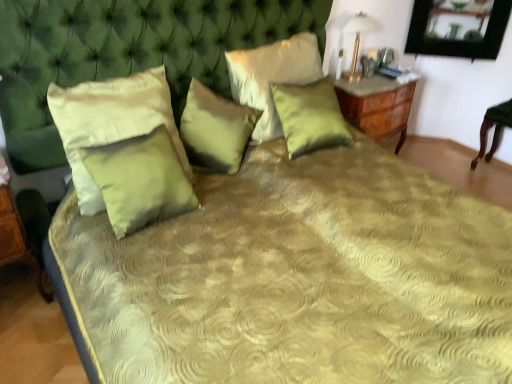
Question: From a real-world perspective, is satin green pillow at upper center, placed as the 4th pillow when sorted from left to right, beneath gold metallic table lamp at upper right?

Choices:
 (A) no
 (B) yes

Answer: (B)

Question: Can we say satin green pillow at upper center, which is counted as the second pillow, starting from the right, lies outside gold metallic table lamp at upper right?

Choices:
 (A) no
 (B) yes

Answer: (B)

Question: Does satin green pillow at upper center, placed as the 4th pillow when sorted from left to right, have a greater width compared to gold metallic table lamp at upper right?

Choices:
 (A) yes
 (B) no

Answer: (A)

Question: Does satin green pillow at upper center, which is counted as the second pillow, starting from the right, have a greater height compared to gold metallic table lamp at upper right?

Choices:
 (A) yes
 (B) no

Answer: (A)

Question: Does satin green pillow at upper center, placed as the 4th pillow when sorted from left to right, have a smaller size compared to gold metallic table lamp at upper right?

Choices:
 (A) yes
 (B) no

Answer: (B)

Question: Is matte green pillow at left, the fifth pillow viewed from the right, wider or thinner than satin green pillow at center, which is the 3th pillow from right to left?

Choices:
 (A) wide
 (B) thin

Answer: (B)

Question: Does point tap(83, 99) appear closer or farther from the camera than point tap(234, 142)?

Choices:
 (A) farther
 (B) closer

Answer: (B)

Question: From a real-world perspective, is matte green pillow at left, arranged as the 1th pillow when viewed from the left, positioned above or below satin green pillow at center, which is the 3th pillow from right to left?

Choices:
 (A) below
 (B) above

Answer: (B)

Question: Is matte green pillow at left, the fifth pillow viewed from the right, in front of or behind satin green pillow at center, which is the 3th pillow from right to left, in the image?

Choices:
 (A) front
 (B) behind

Answer: (A)

Question: From the image's perspective, is satin green pillow at center, the second pillow in the left-to-right sequence, positioned above or below wooden table at lower left?

Choices:
 (A) above
 (B) below

Answer: (A)

Question: Based on their sizes in the image, would you say satin green pillow at center, the fourth pillow viewed from the right, is bigger or smaller than wooden table at lower left?

Choices:
 (A) big
 (B) small

Answer: (B)

Question: From a real-world perspective, relative to wooden table at lower left, is satin green pillow at center, the second pillow in the left-to-right sequence, vertically above or below?

Choices:
 (A) above
 (B) below

Answer: (A)

Question: Do you think satin green pillow at center, the second pillow in the left-to-right sequence, is within wooden table at lower left, or outside of it?

Choices:
 (A) outside
 (B) inside

Answer: (A)

Question: Which is correct: green satin pillow at upper center, which is the 5th pillow in left-to-right order, is inside satin green pillow at center, which is the 3th pillow from right to left, or outside of it?

Choices:
 (A) inside
 (B) outside

Answer: (B)

Question: From the image's perspective, is green satin pillow at upper center, which is the 5th pillow in left-to-right order, positioned above or below satin green pillow at center, positioned as the third pillow in left-to-right order?

Choices:
 (A) above
 (B) below

Answer: (A)